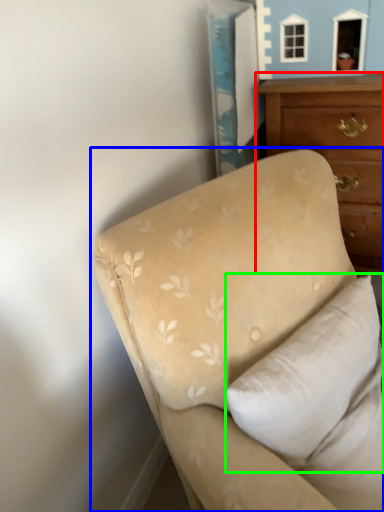
Question: Based on their relative distances, which object is nearer to chest of drawers (highlighted by a red box)? Choose from studio couch (highlighted by a blue box) and pillow (highlighted by a green box).

Choices:
 (A) studio couch
 (B) pillow

Answer: (A)